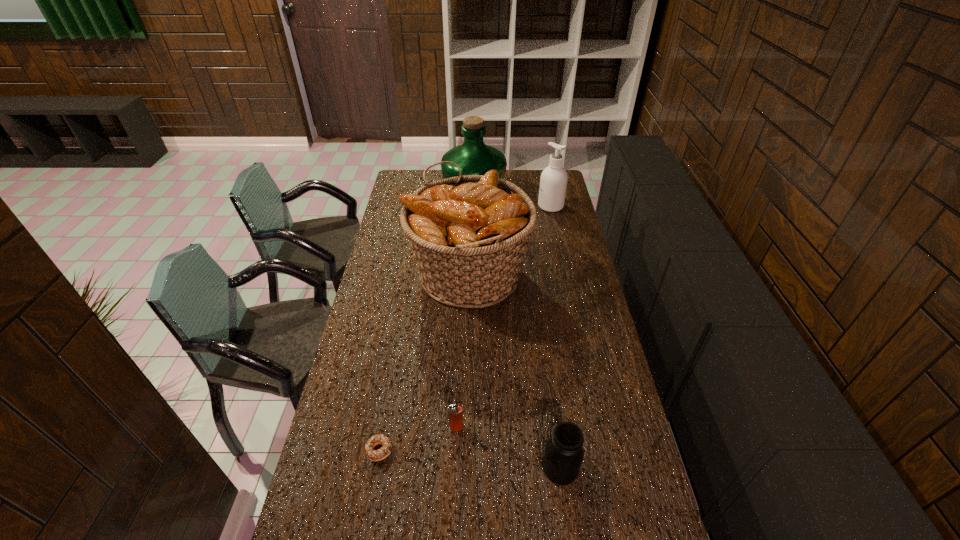
Find the location of a particular element. vacant area at the far edge is located at coordinates (523, 187).

In the image, there is a desktop. At what (x,y) coordinates should I click in order to perform the action: click on free space at the left edge. Please return your answer as a coordinate pair (x, y). This screenshot has width=960, height=540. Looking at the image, I should click on (358, 508).

The image size is (960, 540). I want to click on free space at the right edge of the desktop, so click(561, 234).

At what (x,y) coordinates should I click in order to perform the action: click on vacant space at the far left corner of the desktop. Please return your answer as a coordinate pair (x, y). The image size is (960, 540). Looking at the image, I should click on (428, 172).

The image size is (960, 540). In order to click on unoccupied area between the third shortest object and the fourth nearest object in this screenshot , I will do `click(515, 372)`.

Find the location of a particular element. The width and height of the screenshot is (960, 540). free space between the fourth tallest object and the fourth shortest object is located at coordinates (556, 337).

Where is `vacant point located between the rightmost object and the igniter`? The image size is (960, 540). vacant point located between the rightmost object and the igniter is located at coordinates (504, 317).

The image size is (960, 540). I want to click on vacant area that lies between the third farthest object and the doughnut, so click(x=424, y=363).

You are a GUI agent. You are given a task and a screenshot of the screen. Output one action in this format:
    pyautogui.click(x=<x>, y=<y>)
    Task: Click on the vacant point located between the second shortest object and the third farthest object
    This screenshot has height=540, width=960.
    Given the screenshot: What is the action you would take?
    pyautogui.click(x=463, y=352)

I want to click on empty space that is in between the jar and the rightmost object, so click(556, 337).